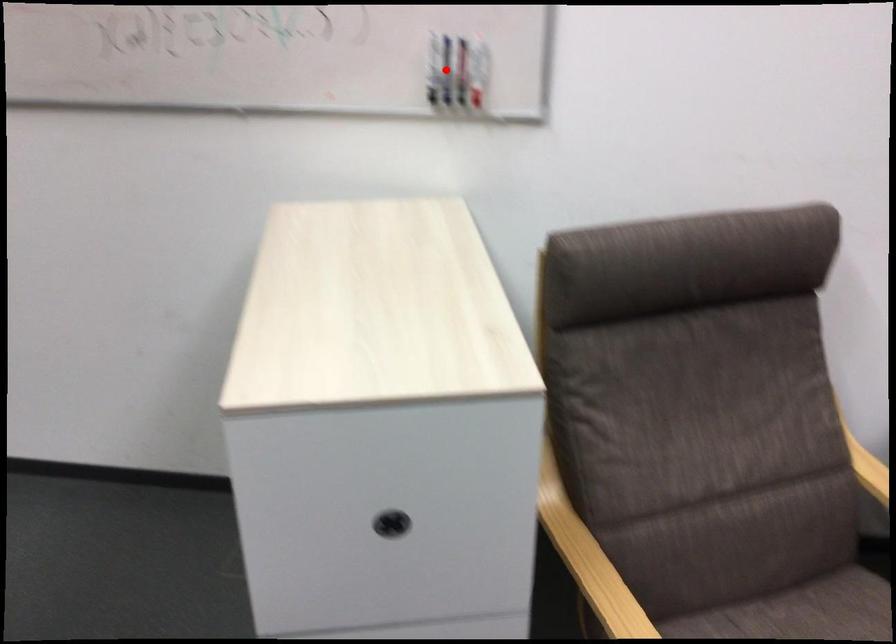
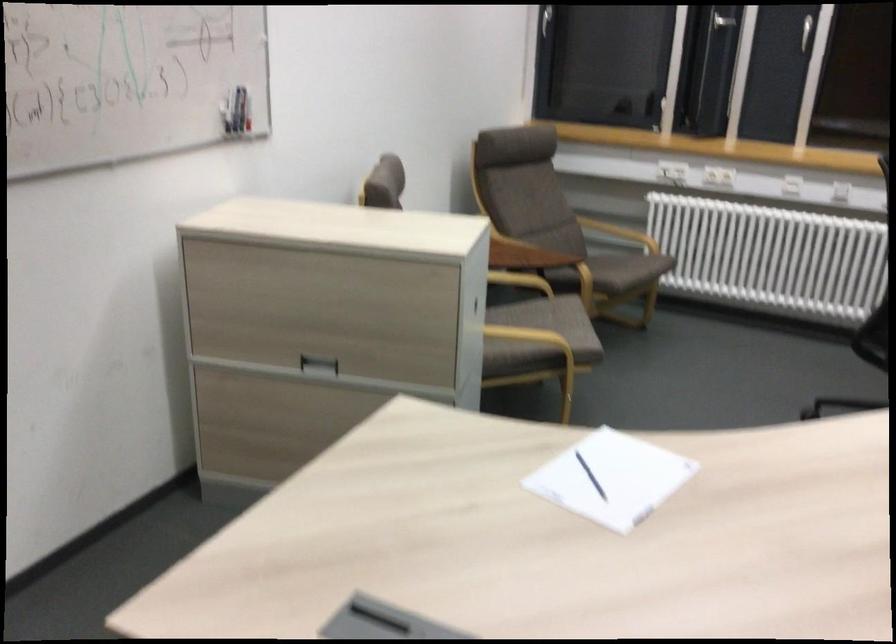
Where in the second image is the point corresponding to the highlighted location from the first image?

(228, 111)